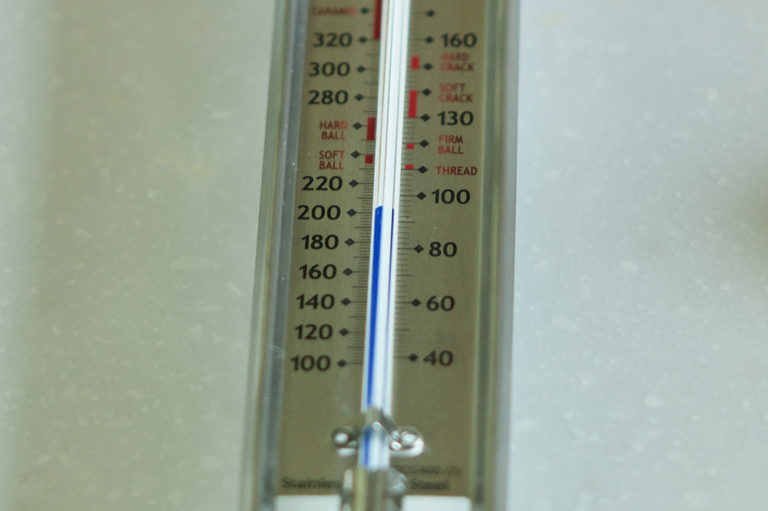
Find the location of a particular element. The image size is (768, 511). thermometer is located at coordinates (385, 276).